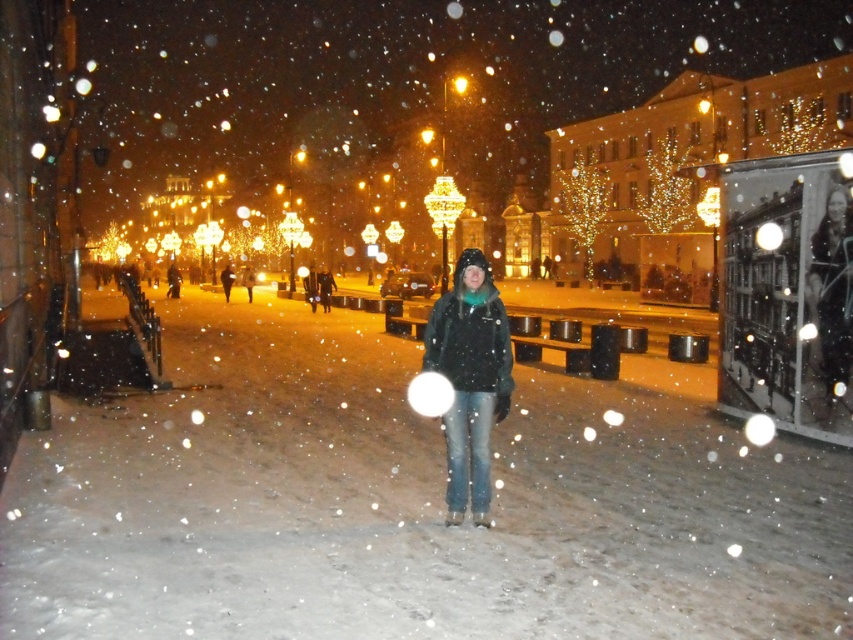
Question: Is matte black jacket at center positioned in front of dark green jacket at center?

Choices:
 (A) no
 (B) yes

Answer: (B)

Question: Which object appears closest to the camera in this image?

Choices:
 (A) matte black jacket at center
 (B) dark green jacket at center

Answer: (A)

Question: Does matte black jacket at center have a larger size compared to dark green jacket at center?

Choices:
 (A) no
 (B) yes

Answer: (A)

Question: In this image, where is matte black jacket at center located relative to dark green jacket at center?

Choices:
 (A) left
 (B) right

Answer: (B)